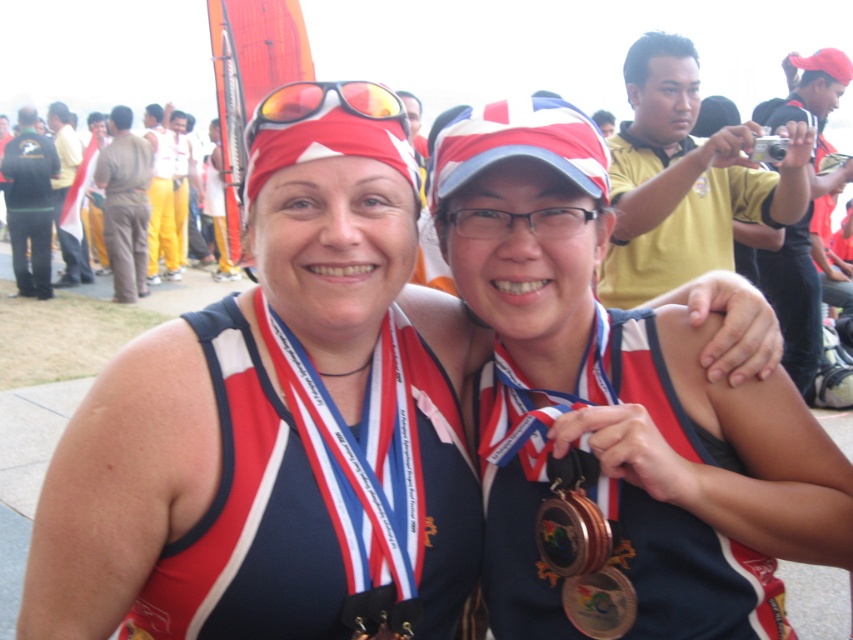
Does point (323, 113) come farther from viewer compared to point (450, 212)?

No.

Does shiny orange goggles at upper center come in front of matte plastic goggles at center?

That is True.

Does point (338, 97) come farther from viewer compared to point (555, 220)?

No, it is in front of (555, 220).

Image resolution: width=853 pixels, height=640 pixels. What are the coordinates of `shiny orange goggles at upper center` in the screenshot? It's located at (325, 104).

Is matte red swimsuit at center positioned before matte plastic goggles at center?

Yes, it is.

Is point (247, 628) in front of point (573, 225)?

Yes.

Between point (196, 369) and point (537, 211), which one is positioned behind?

Point (196, 369)

Where is `matte red swimsuit at center`? The width and height of the screenshot is (853, 640). matte red swimsuit at center is located at coordinates (277, 432).

Which of these two, yellow matte camera at upper right or bronze metallic medal at center, stands taller?

yellow matte camera at upper right is taller.

Is yellow matte camera at upper right positioned in front of bronze metallic medal at center?

No, yellow matte camera at upper right is behind bronze metallic medal at center.

Identify the location of yellow matte camera at upper right. 685,179.

Locate an element on the screen. Image resolution: width=853 pixels, height=640 pixels. yellow matte camera at upper right is located at coordinates (685, 179).